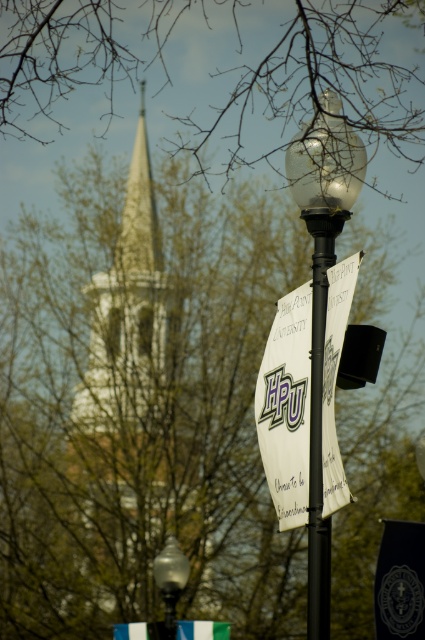
You are a photographer trying to capture the matte glass street light at center in the image. However, the bare branches at upper center are blocking your view. Can you estimate whether the branches are larger or smaller than the street light in size?

The bare branches at upper center is bigger than matte glass street light at center, so the branches are larger and may block the view of the street light.

You are a delivery person trying to place a package between the white paper sign at center and the black metal pole at center. The package is 2 meters long. Can you fit the package between them without bending it?

The distance between the white paper sign at center and the black metal pole at center is 1.93 meters. Since the package is 2 meters long, it is slightly longer than the available space. Therefore, the package cannot be placed between them without bending it.

You are a student walking through the campus and see the white paper sign at center and the black metal pole at center. Which object is smaller in size?

The white paper sign at center is smaller than the black metal pole at center.